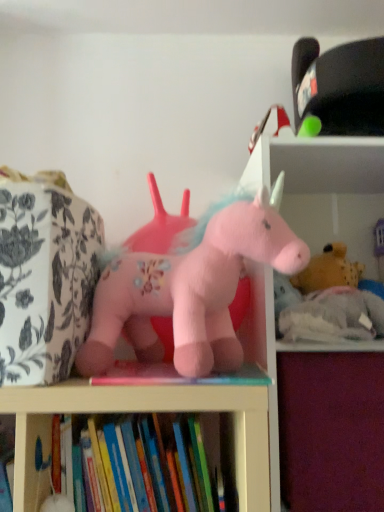
Question: Is soft white bookshelf at upper right at the left side of fluffy pink unicorn at center, which is the 1th toy from front to back?

Choices:
 (A) no
 (B) yes

Answer: (A)

Question: Is the depth of soft white bookshelf at upper right greater than that of fluffy pink unicorn at center, which is the 2th toy from back to front?

Choices:
 (A) no
 (B) yes

Answer: (B)

Question: From the image's perspective, is soft white bookshelf at upper right under fluffy pink unicorn at center, acting as the first toy starting from the left?

Choices:
 (A) no
 (B) yes

Answer: (B)

Question: Does soft white bookshelf at upper right have a greater width compared to fluffy pink unicorn at center, which is counted as the 2th toy, starting from the right?

Choices:
 (A) no
 (B) yes

Answer: (B)

Question: Is soft white bookshelf at upper right not near fluffy pink unicorn at center, acting as the first toy starting from the left?

Choices:
 (A) no
 (B) yes

Answer: (A)

Question: Does soft white bookshelf at upper right have a larger size compared to fluffy pink unicorn at center, acting as the first toy starting from the left?

Choices:
 (A) yes
 (B) no

Answer: (A)

Question: Is there a large distance between fluffy pink unicorn at center, acting as the first toy starting from the left, and purple fabric drawer at lower right?

Choices:
 (A) yes
 (B) no

Answer: (B)

Question: From a real-world perspective, is fluffy pink unicorn at center, acting as the first toy starting from the left, on top of purple fabric drawer at lower right?

Choices:
 (A) yes
 (B) no

Answer: (A)

Question: From the image's perspective, is fluffy pink unicorn at center, acting as the first toy starting from the left, above purple fabric drawer at lower right?

Choices:
 (A) no
 (B) yes

Answer: (B)

Question: Is fluffy pink unicorn at center, which is the 2th toy from back to front, smaller than purple fabric drawer at lower right?

Choices:
 (A) yes
 (B) no

Answer: (A)

Question: Considering the relative sizes of fluffy pink unicorn at center, which is the 1th toy from front to back, and purple fabric drawer at lower right in the image provided, is fluffy pink unicorn at center, which is the 1th toy from front to back, wider than purple fabric drawer at lower right?

Choices:
 (A) no
 (B) yes

Answer: (A)

Question: Is fluffy pink unicorn at center, which is the 1th toy from front to back, turned away from purple fabric drawer at lower right?

Choices:
 (A) yes
 (B) no

Answer: (B)

Question: Is soft white bookshelf at upper right taller than purple fabric drawer at lower right?

Choices:
 (A) yes
 (B) no

Answer: (A)